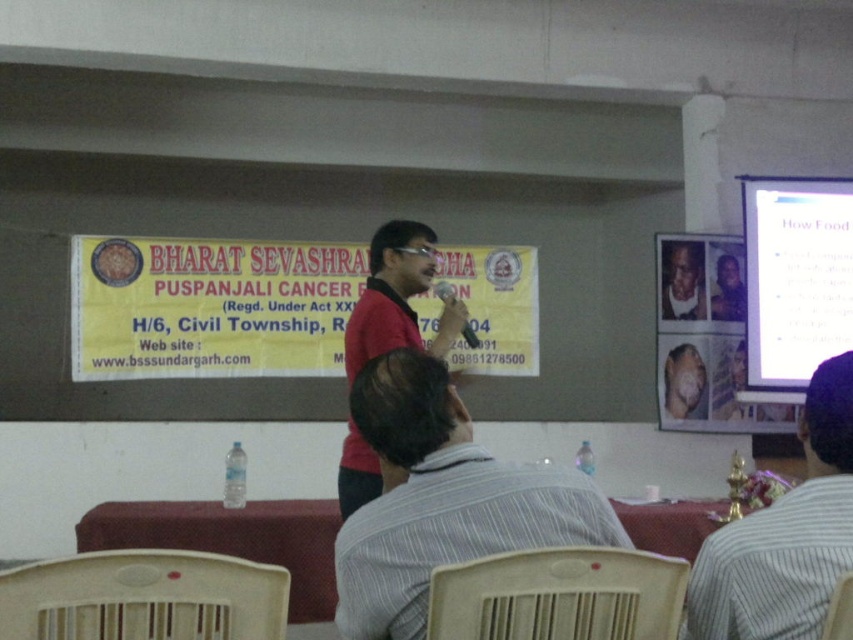
You are sitting at the table with the red cloth and want to look at the white glossy projection screen at upper right. In which direction should you turn your head?

You should turn your head to the upper right to look at the white glossy projection screen at upper right, as it is located at point (793, 280).

You are a speaker at a presentation and want to ensure your audience can see both the white glossy projection screen at upper right and the smooth beige skin at center clearly. Which object is positioned higher in the visual field?

The white glossy projection screen at upper right is above smooth beige skin at center, so it is positioned higher in the visual field.

You are an event planner setting up a photo backdrop for the event. The banner has limited space. You need to place both the smooth skin face at upper right and the purple glossy photo frame at upper center. Which object requires more horizontal space?

The smooth skin face at upper right requires more horizontal space because its width surpasses that of the purple glossy photo frame at upper center.